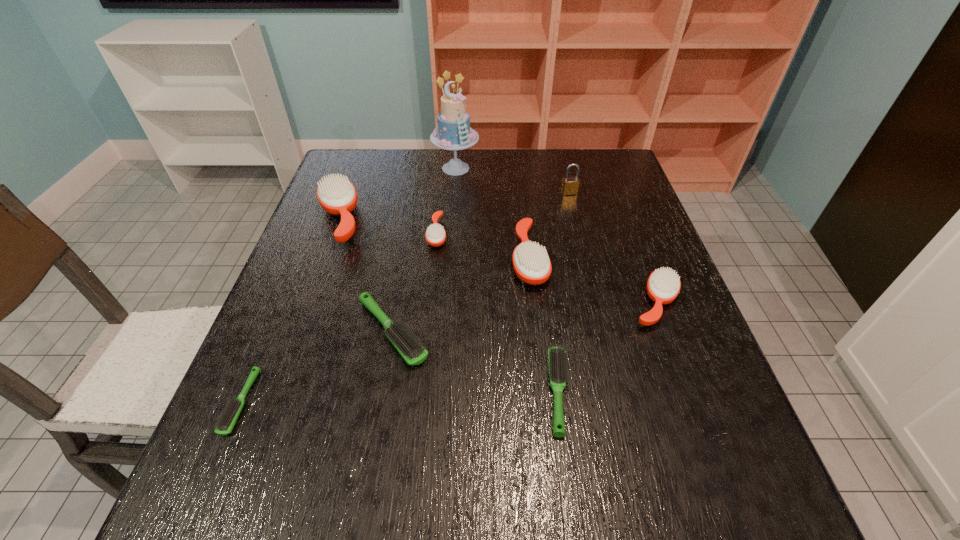
You are a GUI agent. You are given a task and a screenshot of the screen. Output one action in this format:
    pyautogui.click(x=<x>, y=<y>)
    Task: Click on the empty space that is in between the second light hairbrush from right to left and the farthest object
    Image resolution: width=960 pixels, height=540 pixels.
    Given the screenshot: What is the action you would take?
    pyautogui.click(x=424, y=250)

Locate an element on the screen. The image size is (960, 540). free space between the padlock and the third orange hairbrush from right to left is located at coordinates (503, 213).

Where is `vacant region between the fifth shortest hairbrush and the biggest light hairbrush`? Image resolution: width=960 pixels, height=540 pixels. vacant region between the fifth shortest hairbrush and the biggest light hairbrush is located at coordinates (524, 317).

Find the location of a particular element. The width and height of the screenshot is (960, 540). unoccupied position between the rightmost light hairbrush and the second light hairbrush from left to right is located at coordinates (475, 362).

Find the location of a particular element. The height and width of the screenshot is (540, 960). object that stands as the seventh closest to the second orange hairbrush from left to right is located at coordinates (663, 286).

Identify the location of object that is the seventh closest one to the shortest object. (663, 286).

The width and height of the screenshot is (960, 540). Find the location of `hairbrush that is the fourth closest to the tallest hairbrush`. hairbrush that is the fourth closest to the tallest hairbrush is located at coordinates (531, 263).

Identify the location of hairbrush that can be found as the fifth closest to the tallest object. (663, 286).

Locate an element on the screen. the fourth closest orange hairbrush to the blue cake is located at coordinates (663, 286).

Identify which orange hairbrush is the third nearest to the biggest orange hairbrush. Please provide its 2D coordinates. Your answer should be formatted as a tuple, i.e. [(x, y)], where the tuple contains the x and y coordinates of a point satisfying the conditions above.

[(663, 286)]